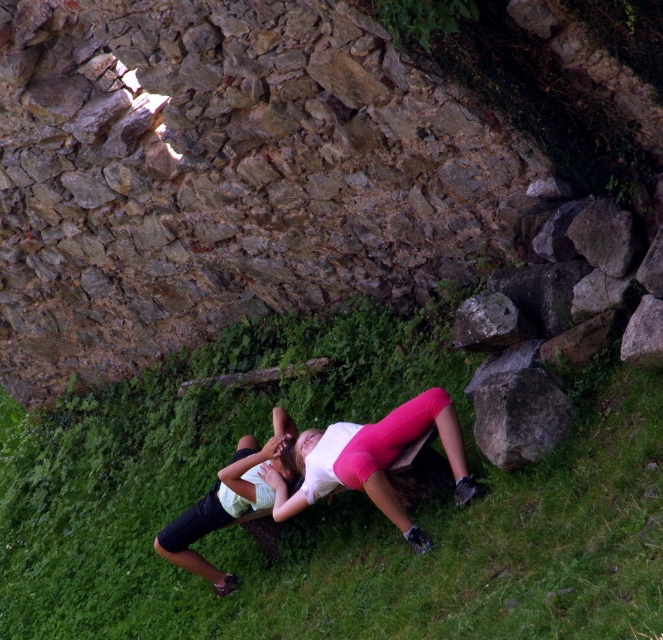
Question: Which point is closer to the camera taking this photo?

Choices:
 (A) (375, 460)
 (B) (164, 529)
 (C) (91, 442)
 (D) (528, 410)

Answer: (D)

Question: Is white matte leggings at center to the left of smooth gray rock at center from the viewer's perspective?

Choices:
 (A) no
 (B) yes

Answer: (B)

Question: Which object appears farthest from the camera in this image?

Choices:
 (A) white matte leggings at center
 (B) white matte shorts at lower center
 (C) smooth gray rock at center
 (D) gray rough rock at lower right

Answer: (B)

Question: Is white matte leggings at center to the right of gray rough rock at lower right from the viewer's perspective?

Choices:
 (A) no
 (B) yes

Answer: (A)

Question: Can you confirm if white matte leggings at center is wider than white matte shorts at lower center?

Choices:
 (A) no
 (B) yes

Answer: (B)

Question: Which point is closer to the camera?

Choices:
 (A) (320, 490)
 (B) (292, 422)
 (C) (493, 296)
 (D) (538, 396)

Answer: (D)